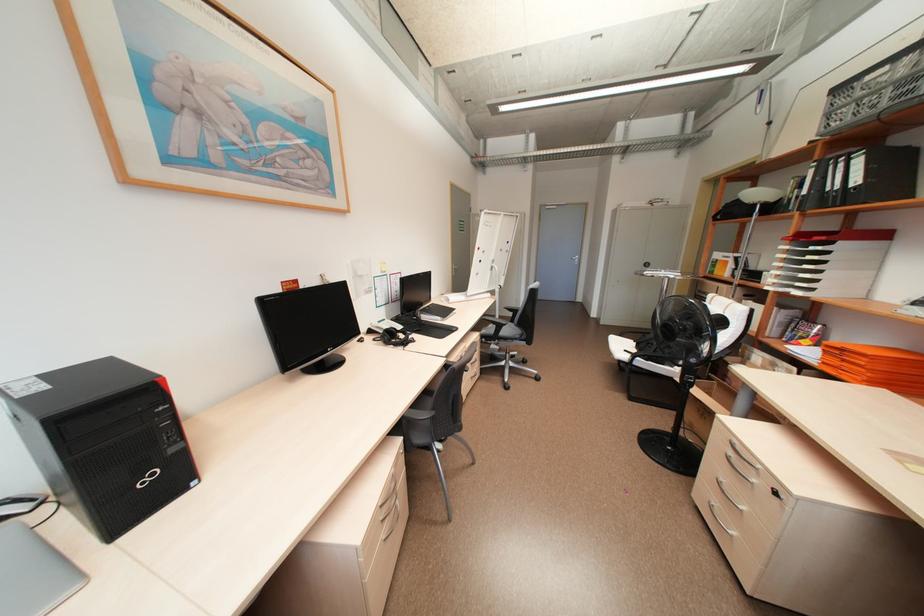
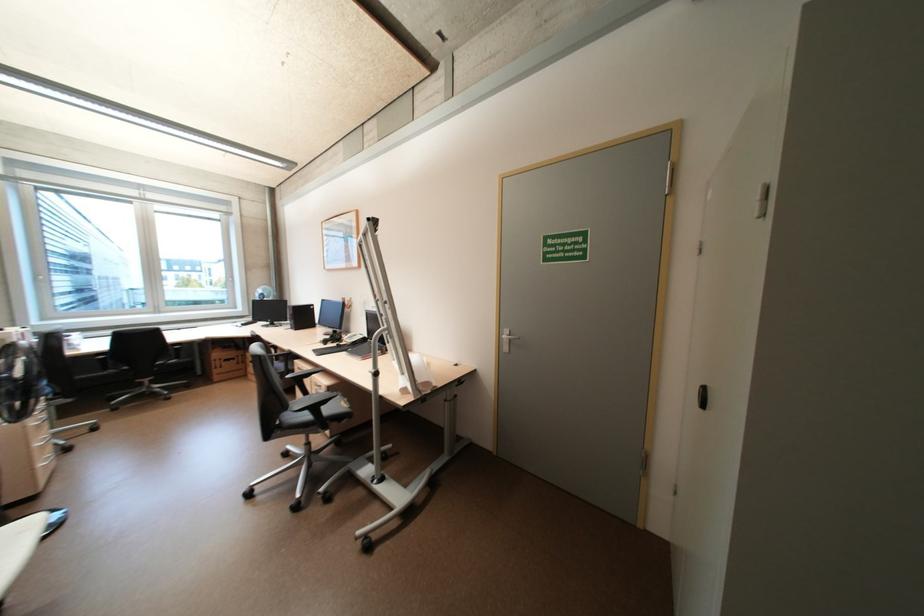
Find the pixel in the second image that matches the point at 499,323 in the first image.

(314, 377)